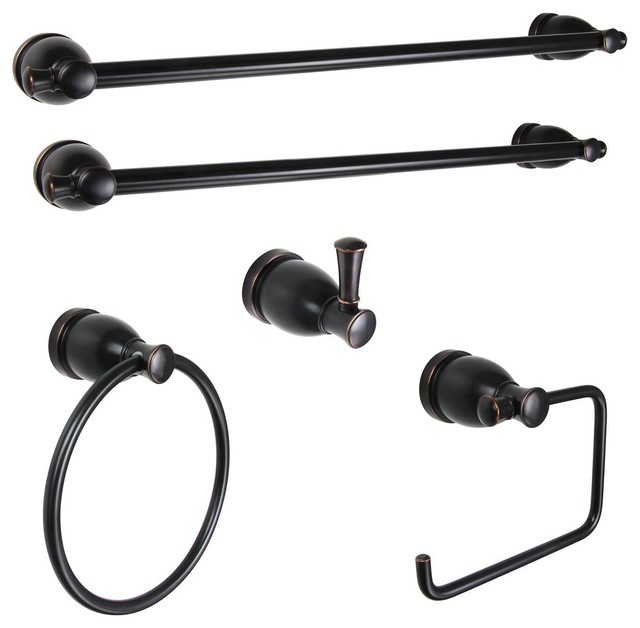
In order to click on knob in this screenshot , I will do `click(352, 266)`.